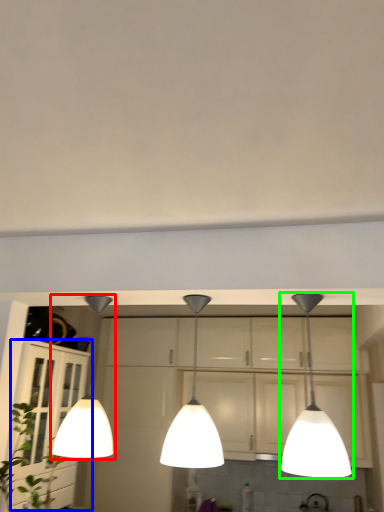
Question: Estimate the real-world distances between objects in this image. Which object is closer to lamp (highlighted by a red box), cabinetry (highlighted by a blue box) or lamp (highlighted by a green box)?

Choices:
 (A) cabinetry
 (B) lamp

Answer: (A)